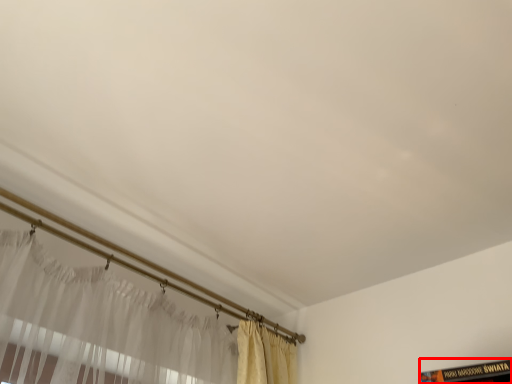
Question: From the image's perspective, what is the correct spatial positioning of book (annotated by the red box) in reference to curtain?

Choices:
 (A) above
 (B) below

Answer: (B)